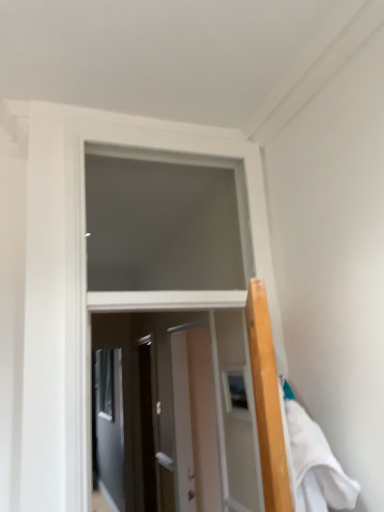
Identify the location of transparent glass screen door at center. (147, 424).

This screenshot has height=512, width=384. What do you see at coordinates (147, 424) in the screenshot?
I see `transparent glass screen door at center` at bounding box center [147, 424].

Find the location of a particular element. transparent glass screen door at center is located at coordinates (147, 424).